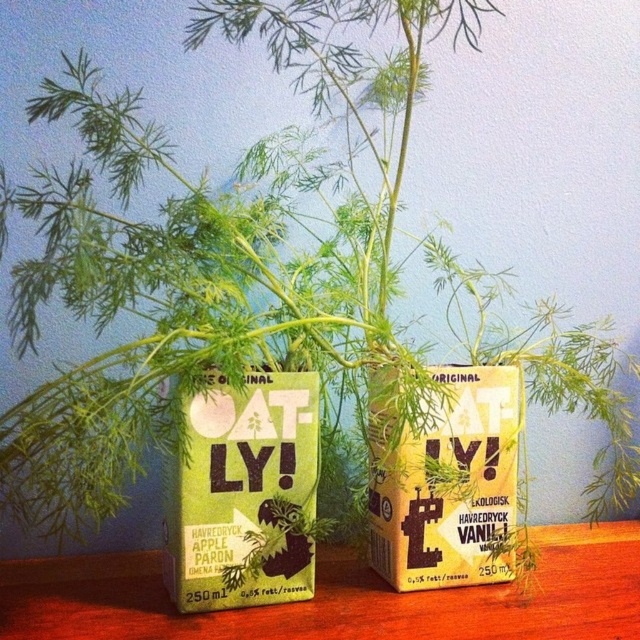
You are standing in front of the two Oatly oat milk cartons. If you want to reach the point that is closer to you, which point should you choose between point (x=259, y=449) and point (x=420, y=529)?

Point (x=259, y=449) is in front of point (x=420, y=529), so you should choose point (x=259, y=449) as it is closer to you.

You are arranging items on a wooden table at center and a yellow paper carton at center. Which object is more to the left?

The wooden table at center is positioned on the left side of the yellow paper carton at center, so the wooden table at center is more to the left.